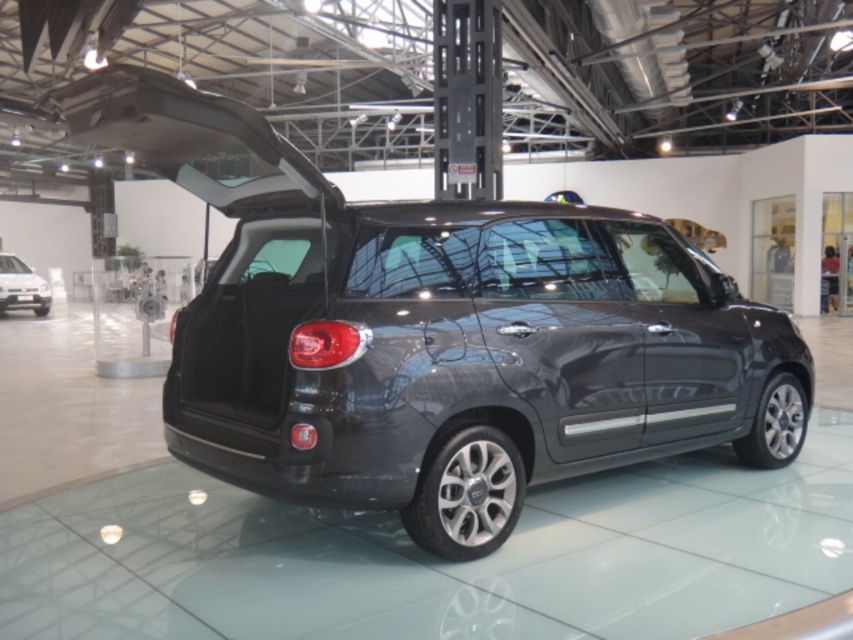
Question: Is satin black car at center below matte black car at lower left?

Choices:
 (A) no
 (B) yes

Answer: (B)

Question: Can you confirm if satin black car at center is wider than matte black car at lower left?

Choices:
 (A) no
 (B) yes

Answer: (B)

Question: Is satin black car at center bigger than matte black car at lower left?

Choices:
 (A) yes
 (B) no

Answer: (A)

Question: Among these points, which one is farthest from the camera?

Choices:
 (A) (322, 177)
 (B) (41, 294)

Answer: (B)

Question: Which point is farther from the camera taking this photo?

Choices:
 (A) (9, 296)
 (B) (117, 113)

Answer: (A)